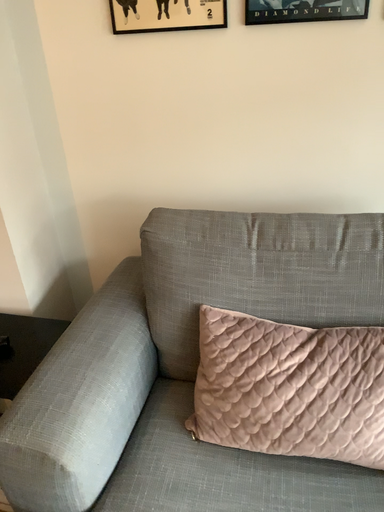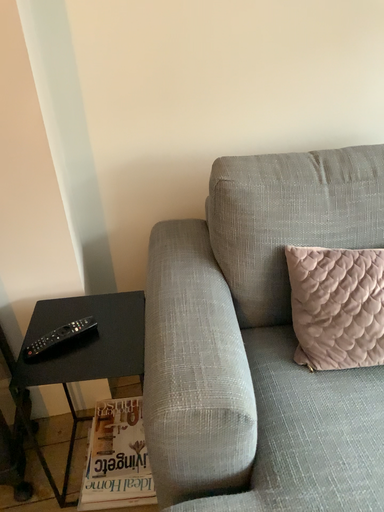
Question: Which way did the camera rotate in the video?

Choices:
 (A) rotated left
 (B) rotated right

Answer: (B)